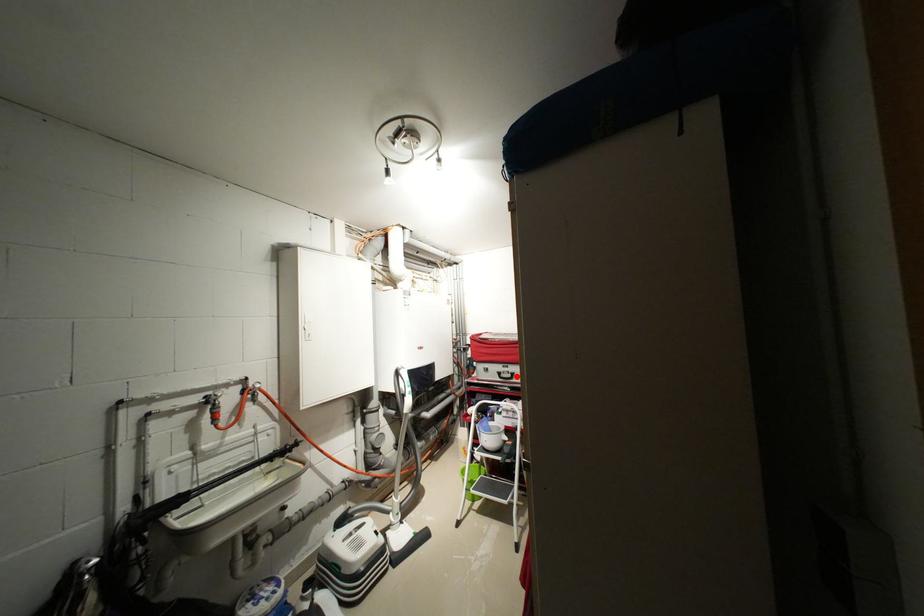
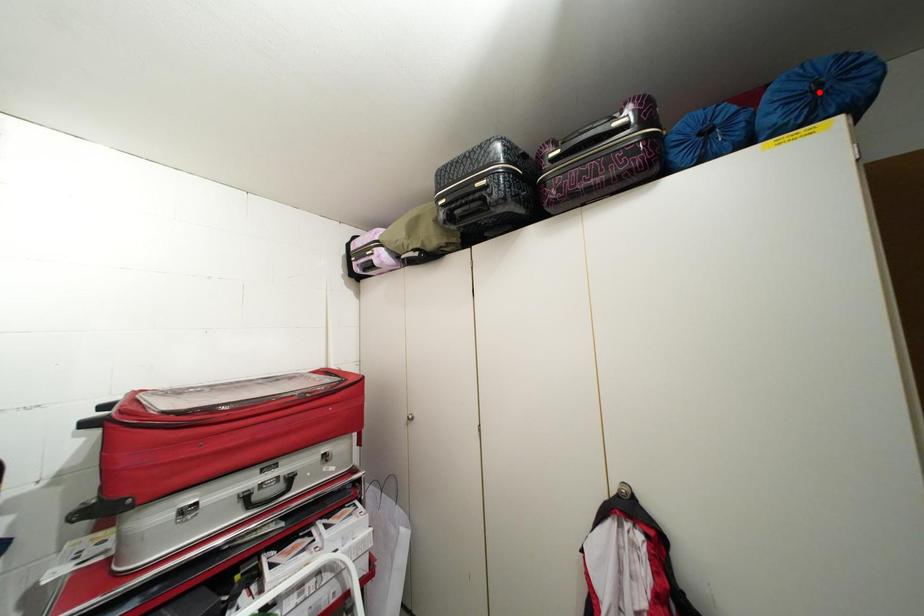
I am providing you with two images of the same scene from different viewpoints. A red point is marked on the first image and another point is marked on the second image. Does the point marked in image1 correspond to the same location as the one in image2?

No